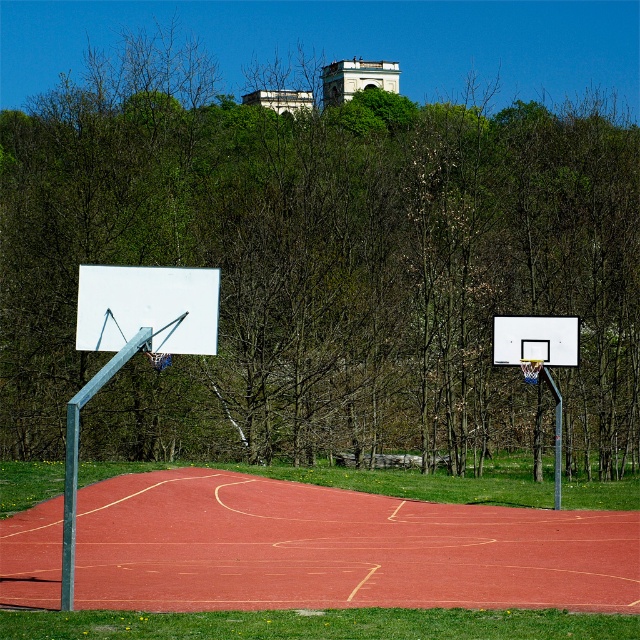
Question: Is the position of brown leafless tree at center less distant than that of white glossy basketball backboard at center?

Choices:
 (A) no
 (B) yes

Answer: (B)

Question: Observing the image, what is the correct spatial positioning of rubberized red basketball court at center in reference to white matte basketball backboard at left?

Choices:
 (A) above
 (B) below

Answer: (B)

Question: Does white matte basketball backboard at left come in front of white glossy basketball backboard at center?

Choices:
 (A) yes
 (B) no

Answer: (A)

Question: Considering the real-world distances, which object is farthest from the white glossy basketball backboard at center?

Choices:
 (A) white plastic basketball hoop at center
 (B) rubberized red basketball court at center

Answer: (B)

Question: Which of the following is the closest to the observer?

Choices:
 (A) (32, 536)
 (B) (508, 332)

Answer: (A)

Question: Which of the following is the farthest from the observer?

Choices:
 (A) white glossy basketball backboard at center
 (B) white matte basketball backboard at left
 (C) white plastic basketball hoop at center
 (D) rubberized red basketball court at center

Answer: (A)